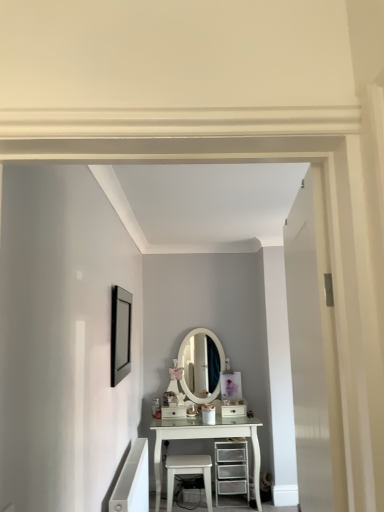
Locate an element on the screen. This screenshot has height=512, width=384. free space above white glossy drawer at center, which ranks as the 1th drawer in right-to-left order (from a real-world perspective) is located at coordinates (230, 402).